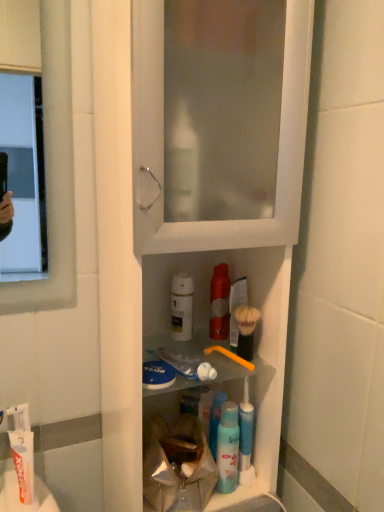
Question: Is blue plastic mouthwash at center in front of white glossy lotion at center?

Choices:
 (A) no
 (B) yes

Answer: (B)

Question: Does blue plastic mouthwash at center have a lesser height compared to white glossy lotion at center?

Choices:
 (A) yes
 (B) no

Answer: (B)

Question: Is blue plastic mouthwash at center positioned beyond the bounds of white glossy lotion at center?

Choices:
 (A) no
 (B) yes

Answer: (B)

Question: Can you confirm if blue plastic mouthwash at center is taller than white glossy lotion at center?

Choices:
 (A) yes
 (B) no

Answer: (A)

Question: Could you tell me if blue plastic mouthwash at center is turned towards white glossy lotion at center?

Choices:
 (A) no
 (B) yes

Answer: (A)

Question: From a real-world perspective, is blue plastic mouthwash at center physically above white glossy lotion at center?

Choices:
 (A) no
 (B) yes

Answer: (A)

Question: Is blue plastic mouthwash at center closer to camera compared to white plastic cabinet at center?

Choices:
 (A) no
 (B) yes

Answer: (A)

Question: Is blue plastic mouthwash at center far from white plastic cabinet at center?

Choices:
 (A) yes
 (B) no

Answer: (B)

Question: Is blue plastic mouthwash at center facing towards white plastic cabinet at center?

Choices:
 (A) no
 (B) yes

Answer: (B)

Question: Is blue plastic mouthwash at center to the right of white plastic cabinet at center from the viewer's perspective?

Choices:
 (A) no
 (B) yes

Answer: (B)

Question: Considering the relative positions of blue plastic mouthwash at center and white plastic cabinet at center in the image provided, is blue plastic mouthwash at center to the left of white plastic cabinet at center from the viewer's perspective?

Choices:
 (A) yes
 (B) no

Answer: (B)

Question: Would you say white plastic cabinet at center is part of blue plastic mouthwash at center's contents?

Choices:
 (A) no
 (B) yes

Answer: (A)

Question: Is white glossy lotion at center surrounding yellow plastic toothbrush at center-right?

Choices:
 (A) yes
 (B) no

Answer: (B)